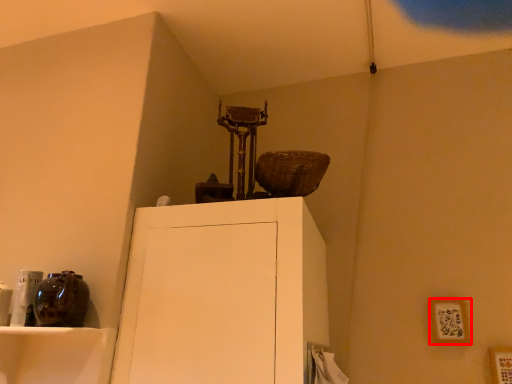
Question: From the image's perspective, considering the relative positions of picture frame (annotated by the red box) and picture frame in the image provided, where is picture frame (annotated by the red box) located with respect to the staircase?

Choices:
 (A) above
 (B) below

Answer: (A)